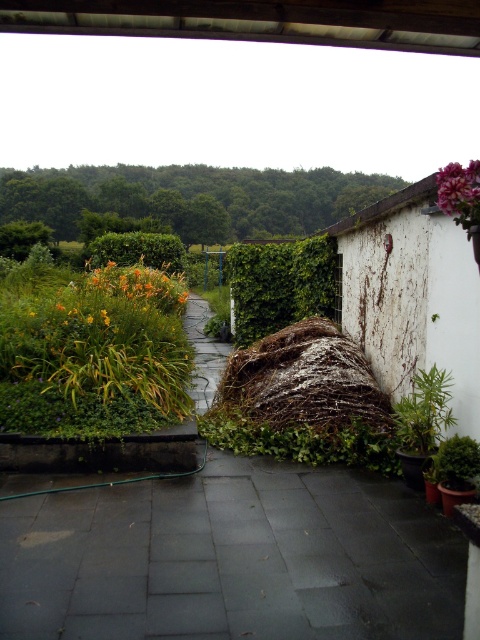
Question: Can you confirm if green leafy vegetation at upper center is smaller than yellow matte flower at upper left?

Choices:
 (A) yes
 (B) no

Answer: (B)

Question: Considering the relative positions of green stone path at center and green leafy vegetation at upper center in the image provided, where is green stone path at center located with respect to green leafy vegetation at upper center?

Choices:
 (A) right
 (B) left

Answer: (A)

Question: Which point is farther from the camera taking this photo?

Choices:
 (A) (172, 305)
 (B) (59, 234)
 (C) (108, 497)

Answer: (B)

Question: Among these objects, which one is nearest to the camera?

Choices:
 (A) green stone path at center
 (B) pink matte flower at upper right
 (C) yellow matte flower at upper left
 (D) brown textured hay at center

Answer: (A)

Question: Is green stone path at center bigger than pink matte flower at upper right?

Choices:
 (A) no
 (B) yes

Answer: (A)

Question: Which object is the closest to the pink matte flower at upper right?

Choices:
 (A) green stone path at center
 (B) brown textured hay at center
 (C) yellow matte flower at upper left
 (D) green leafy vegetation at upper center

Answer: (B)